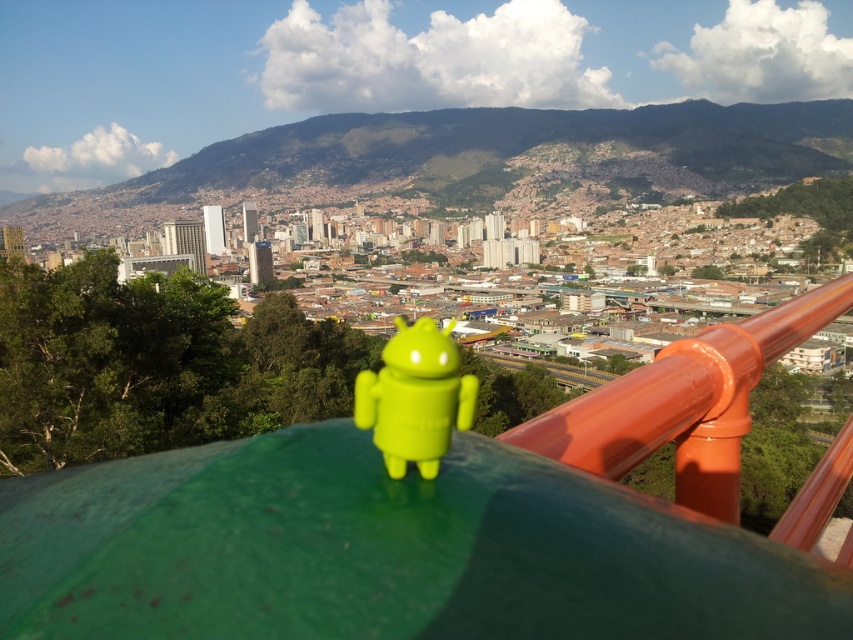
Question: Does orange glossy rail at upper right have a smaller size compared to green matte android figure at center?

Choices:
 (A) yes
 (B) no

Answer: (B)

Question: Does orange glossy rail at upper right come behind green matte android figure at center?

Choices:
 (A) no
 (B) yes

Answer: (B)

Question: Is orange glossy rail at upper right to the right of green matte android figure at center from the viewer's perspective?

Choices:
 (A) no
 (B) yes

Answer: (B)

Question: Which point is farther from the camera taking this photo?

Choices:
 (A) (376, 444)
 (B) (811, 522)

Answer: (B)

Question: Which point is closer to the camera?

Choices:
 (A) (469, 419)
 (B) (840, 284)

Answer: (A)